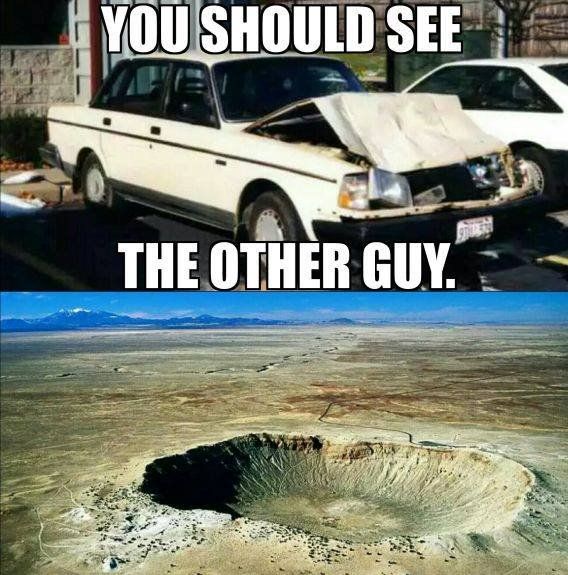
Image resolution: width=568 pixels, height=575 pixels. Identify the location of door handle. tap(154, 131), tap(103, 124).